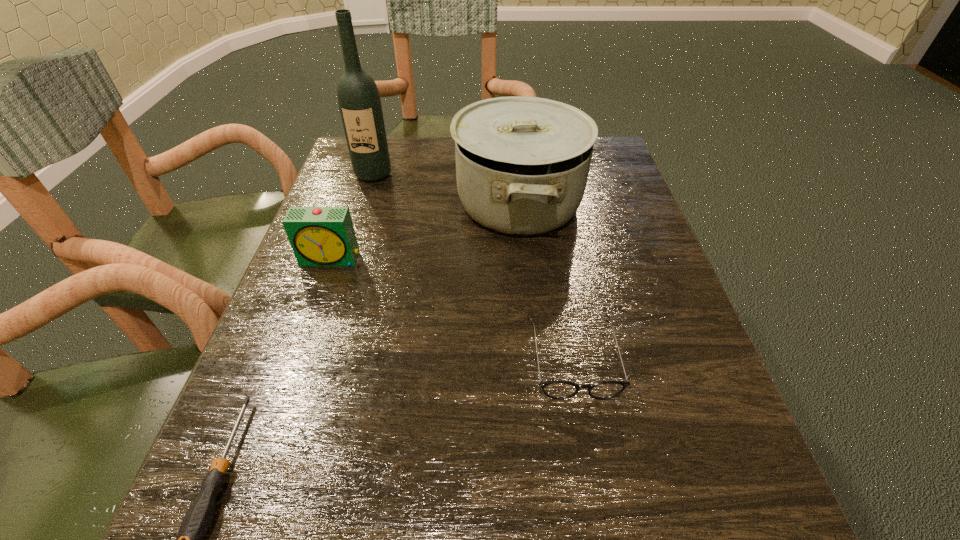
Locate an element on the screen. The height and width of the screenshot is (540, 960). vacant space at the far left corner of the desktop is located at coordinates (339, 181).

Locate an element on the screen. This screenshot has height=540, width=960. free space at the near left corner is located at coordinates (318, 498).

This screenshot has height=540, width=960. I want to click on vacant point at the far right corner, so click(x=592, y=182).

You are a GUI agent. You are given a task and a screenshot of the screen. Output one action in this format:
    pyautogui.click(x=<x>, y=<y>)
    Task: Click on the vacant space that's between the wine bottle and the fourth farthest object
    This screenshot has height=540, width=960.
    Given the screenshot: What is the action you would take?
    pyautogui.click(x=473, y=267)

Image resolution: width=960 pixels, height=540 pixels. I want to click on vacant area that lies between the spectacles and the third tallest object, so click(452, 309).

Identify the location of free space between the alarm clock and the fourth farthest object. This screenshot has width=960, height=540. [452, 309].

You are a GUI agent. You are given a task and a screenshot of the screen. Output one action in this format:
    pyautogui.click(x=<x>, y=<y>)
    Task: Click on the vacant region between the wine bottle and the alarm clock
    This screenshot has height=540, width=960.
    Given the screenshot: What is the action you would take?
    pyautogui.click(x=352, y=217)

Locate an element on the screen. free space between the saucepan and the tallest object is located at coordinates (445, 189).

The width and height of the screenshot is (960, 540). I want to click on vacant space that's between the third tallest object and the wine bottle, so click(352, 217).

Image resolution: width=960 pixels, height=540 pixels. I want to click on free area in between the third tallest object and the fourth tallest object, so click(452, 309).